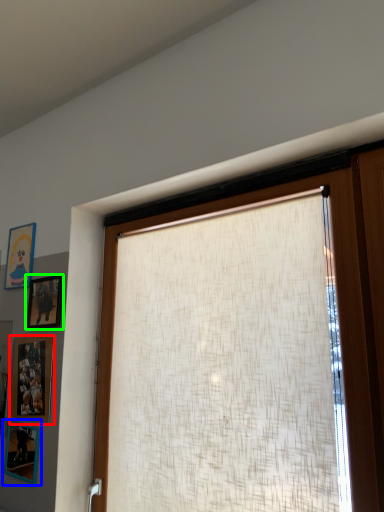
Question: Which is farther away from picture frame (highlighted by a red box)? picture frame (highlighted by a blue box) or picture frame (highlighted by a green box)?

Choices:
 (A) picture frame
 (B) picture frame

Answer: (B)